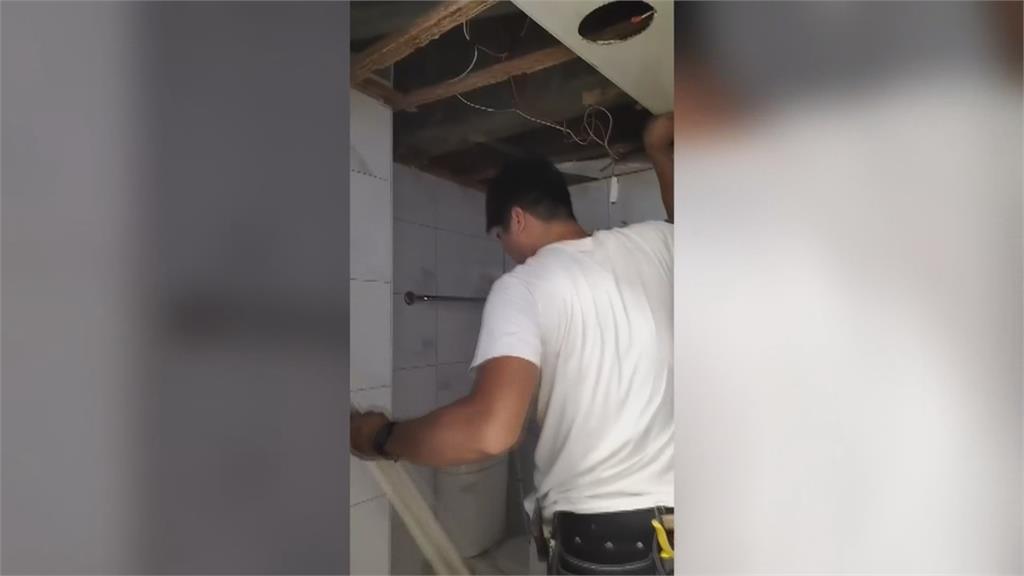
Point out all instances of where you'd install a light fixture in the image. Your answer should be formatted as a list of tuples, i.e. [(x1, y1), (x2, y2), ...], where each tuple contains the x and y coordinates of a point satisfying the conditions above.

[(608, 26)]